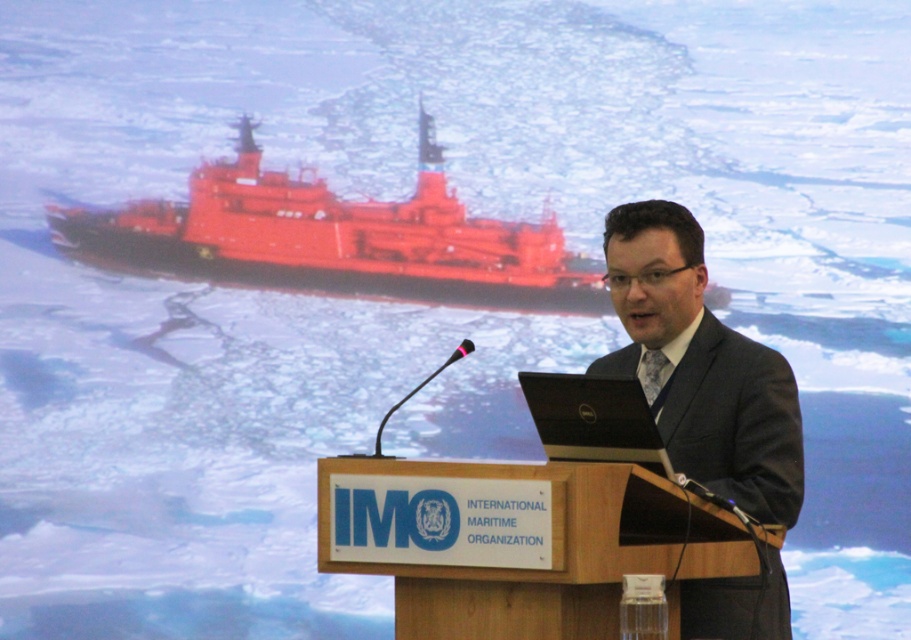
Question: Does wooden podium at center have a greater width compared to metallic red ship at center?

Choices:
 (A) no
 (B) yes

Answer: (A)

Question: Observing the image, what is the correct spatial positioning of wooden podium at center in reference to metallic red ship at center?

Choices:
 (A) left
 (B) right

Answer: (B)

Question: Which point is farther to the camera?

Choices:
 (A) (732, 492)
 (B) (592, 291)
 (C) (602, 508)

Answer: (B)

Question: Among these objects, which one is nearest to the camera?

Choices:
 (A) dark gray suit at center
 (B) wooden podium at center

Answer: (B)

Question: Which of the following is the closest to the observer?

Choices:
 (A) metallic red ship at center
 (B) wooden podium at center

Answer: (B)

Question: Does wooden podium at center appear on the left side of dark gray suit at center?

Choices:
 (A) no
 (B) yes

Answer: (B)